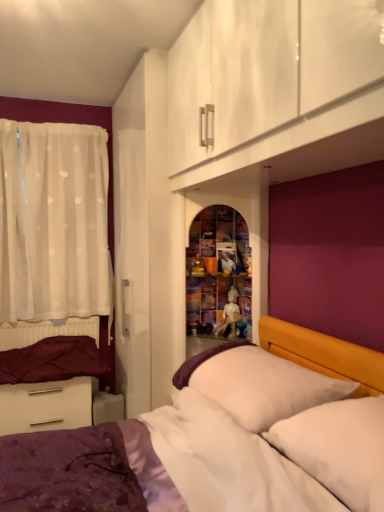
Question: From the image's perspective, is white soft pillow at right, placed as the 2th pillow when sorted from back to front, over white glossy drawer at lower left?

Choices:
 (A) yes
 (B) no

Answer: (A)

Question: From a real-world perspective, is white soft pillow at right, which is the first pillow from front to back, positioned under white glossy drawer at lower left based on gravity?

Choices:
 (A) yes
 (B) no

Answer: (B)

Question: Is white glossy drawer at lower left located within white soft pillow at right, placed as the 2th pillow when sorted from back to front?

Choices:
 (A) yes
 (B) no

Answer: (B)

Question: Is white soft pillow at right, which is the first pillow from front to back, shorter than white glossy drawer at lower left?

Choices:
 (A) yes
 (B) no

Answer: (A)

Question: Considering the relative sizes of white soft pillow at right, which is the first pillow from front to back, and white glossy drawer at lower left in the image provided, is white soft pillow at right, which is the first pillow from front to back, bigger than white glossy drawer at lower left?

Choices:
 (A) yes
 (B) no

Answer: (B)

Question: In terms of width, does matte white bed frame at lower left look wider or thinner when compared to white soft pillow at right, placed as the 2th pillow when sorted from back to front?

Choices:
 (A) wide
 (B) thin

Answer: (B)

Question: Considering the positions of matte white bed frame at lower left and white soft pillow at right, which is the first pillow from front to back, in the image, is matte white bed frame at lower left bigger or smaller than white soft pillow at right, which is the first pillow from front to back,?

Choices:
 (A) big
 (B) small

Answer: (B)

Question: From the image's perspective, is matte white bed frame at lower left positioned above or below white soft pillow at right, placed as the 2th pillow when sorted from back to front?

Choices:
 (A) below
 (B) above

Answer: (A)

Question: In terms of height, does matte white bed frame at lower left look taller or shorter compared to white soft pillow at right, which is the first pillow from front to back?

Choices:
 (A) tall
 (B) short

Answer: (A)

Question: Relative to purple velvet bed at lower left, is white glossy drawer at lower left in front or behind?

Choices:
 (A) front
 (B) behind

Answer: (B)

Question: Considering the positions of white glossy drawer at lower left and purple velvet bed at lower left in the image, is white glossy drawer at lower left wider or thinner than purple velvet bed at lower left?

Choices:
 (A) thin
 (B) wide

Answer: (A)

Question: From a real-world perspective, is white glossy drawer at lower left positioned above or below purple velvet bed at lower left?

Choices:
 (A) above
 (B) below

Answer: (B)

Question: Visually, is white glossy drawer at lower left positioned to the left or to the right of purple velvet bed at lower left?

Choices:
 (A) right
 (B) left

Answer: (B)

Question: Considering the positions of purple velvet bed at lower left and white sheer curtain at left in the image, is purple velvet bed at lower left bigger or smaller than white sheer curtain at left?

Choices:
 (A) big
 (B) small

Answer: (A)

Question: In the image, is purple velvet bed at lower left positioned in front of or behind white sheer curtain at left?

Choices:
 (A) behind
 (B) front

Answer: (B)